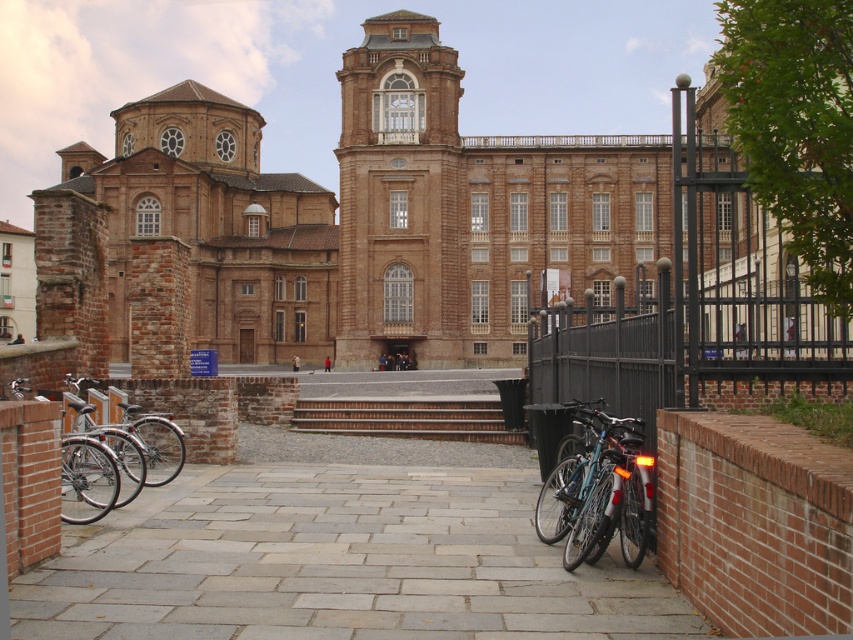
You are standing at the entrance of the historical building complex and want to take a photo of the brown stone church at center. Where should you position yourself to capture it in the frame?

The brown stone church at center is located at coordinates point (372, 214), so you should position yourself at that point to capture it in the frame.

You are a visitor standing in front of the historical building complex. You notice the brown stone church at center and the shiny blue bike at lower right. Which object is taller?

The brown stone church at center is much taller than the shiny blue bike at lower right.